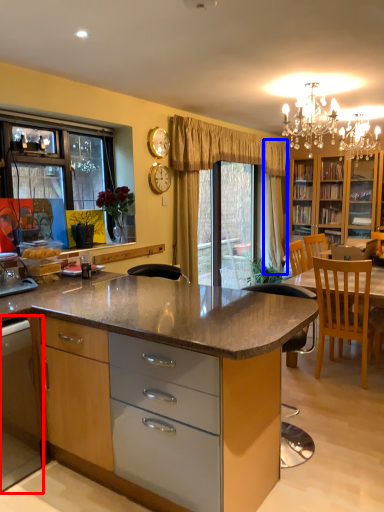
Question: Among these objects, which one is nearest to the camera, cabinetry (highlighted by a red box) or curtain (highlighted by a blue box)?

Choices:
 (A) cabinetry
 (B) curtain

Answer: (A)